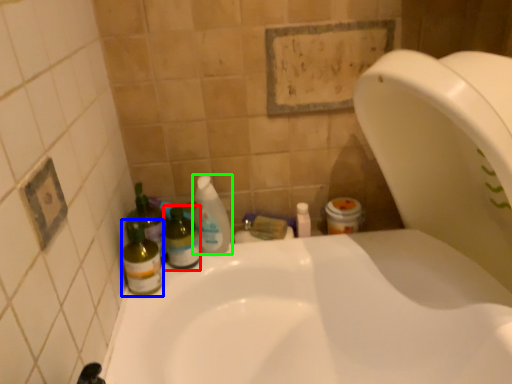
Question: Which is nearer to the bottle (highlighted by a red box)? bottle (highlighted by a blue box) or cleaning product (highlighted by a green box).

Choices:
 (A) bottle
 (B) cleaning product

Answer: (B)